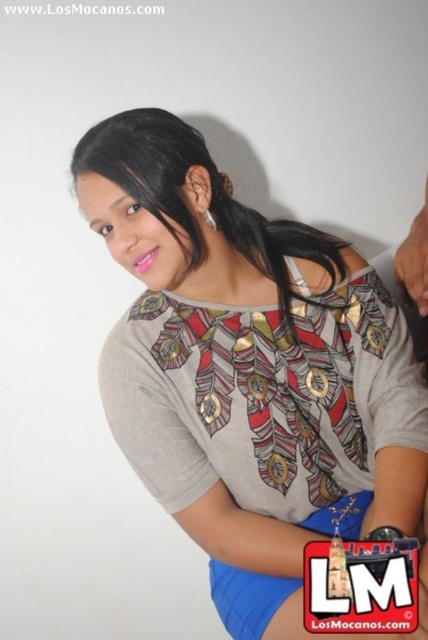
You are standing in front of the person in the image. You notice two points marked on their clothing. The first point is at coordinate point [255,284] and the second is at point [296,292]. Which point is closer to you?

Point [296,292] is closer to you because it is in front of point [255,284].

You are standing in front of the person in the image and want to take a photo of the point at coordinates point (416, 438). If your camera can only focus on objects within 1 meter, will it be able to capture that point clearly?

The point (416, 438) is 94.86 centimeters away from the camera, which is within the 1 meter focus range. Therefore, the camera can capture it clearly.

Where is the printed fabric blouse at center located in the image?

The printed fabric blouse at center is located at point (249, 371).